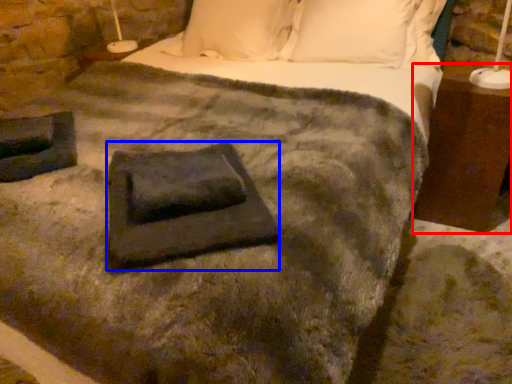
Question: Which point is closer to the camera, nightstand (highlighted by a red box) or slate (highlighted by a blue box)?

Choices:
 (A) nightstand
 (B) slate

Answer: (B)